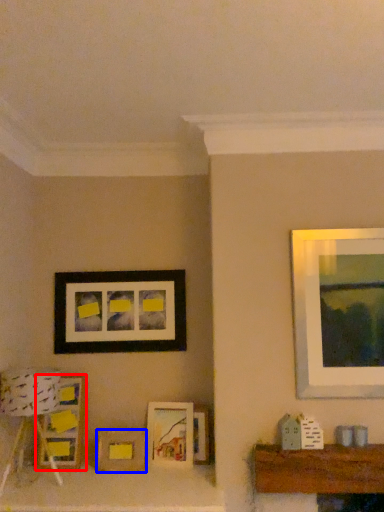
Question: Which object appears closest to the camera in this image, picture frame (highlighted by a red box) or picture frame (highlighted by a blue box)?

Choices:
 (A) picture frame
 (B) picture frame

Answer: (B)